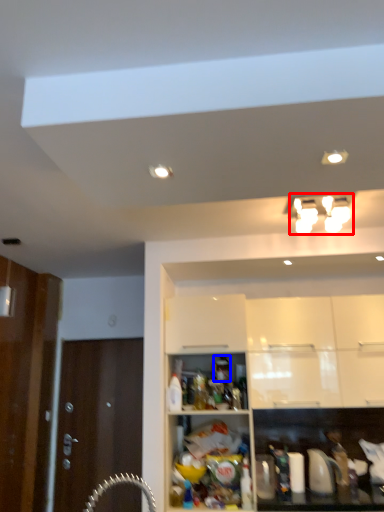
Question: Which of the following is the closest to the observer, light fixture (highlighted by a red box) or beverage (highlighted by a blue box)?

Choices:
 (A) light fixture
 (B) beverage

Answer: (A)